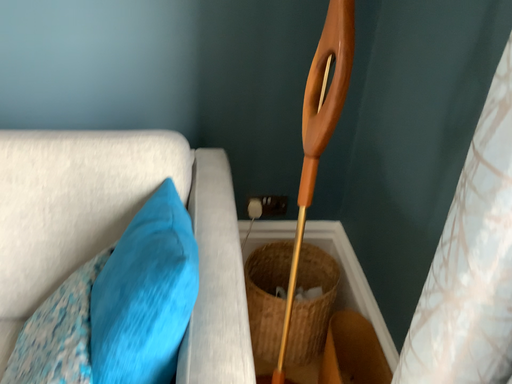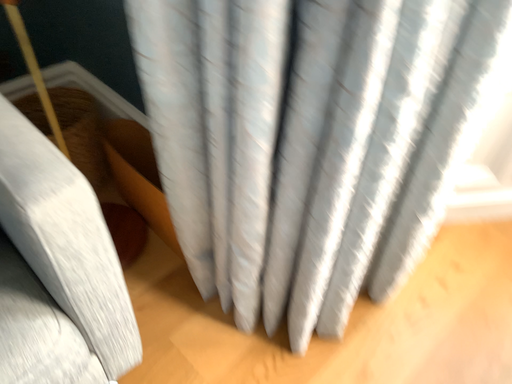
Question: Which way did the camera rotate in the video?

Choices:
 (A) rotated upward
 (B) rotated downward

Answer: (B)